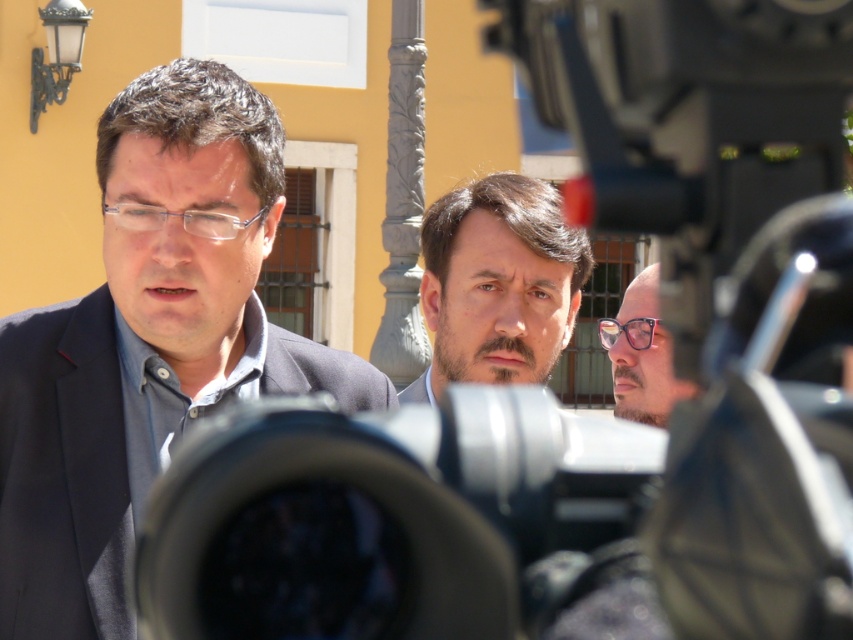
You are a photographer carrying a 0.5 meters wide camera bag. You see the black plastic camera at center and the matte black suit at left in the scene. Can your camera bag fit through the space between them?

The black plastic camera at center is narrower than the matte black suit at left, so the space between them may be sufficient for your 0.5 meters wide camera bag to pass through, but exact dimensions are needed for certainty.

You are a photographer trying to capture a closeup shot of the dark brown hair at center and the pink glossy glasses at center. Which object should you zoom in on more to ensure both are in focus?

The dark brown hair at center occupies less space than the pink glossy glasses at center, so you should zoom in more on the dark brown hair at center to ensure both are in focus.

You are a costume designer observing the scene. You need to determine which object occupies more horizontal space in the image between the matte black suit at left and the dark brown hair at center. Which one is wider?

The matte black suit at left is wider than the dark brown hair at center according to the description provided.